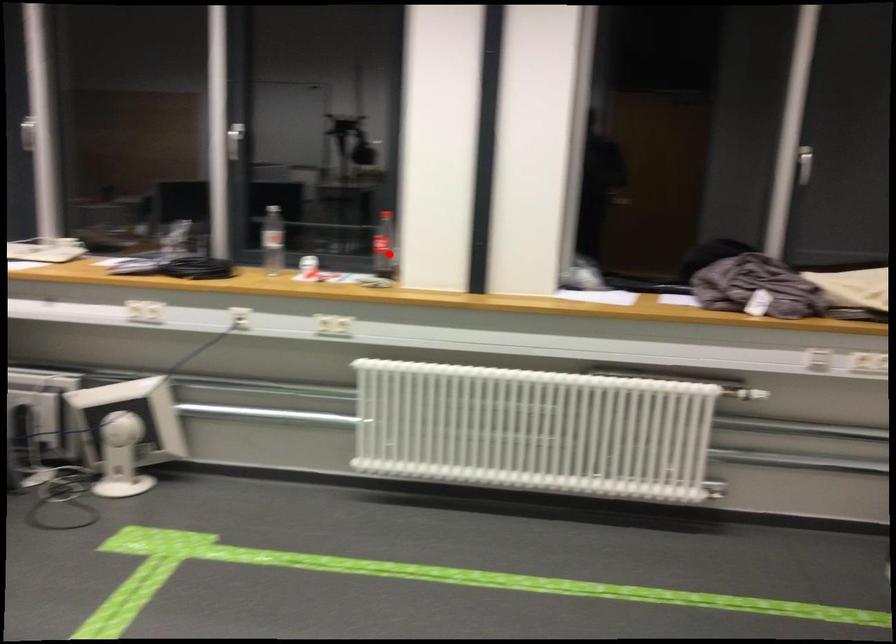
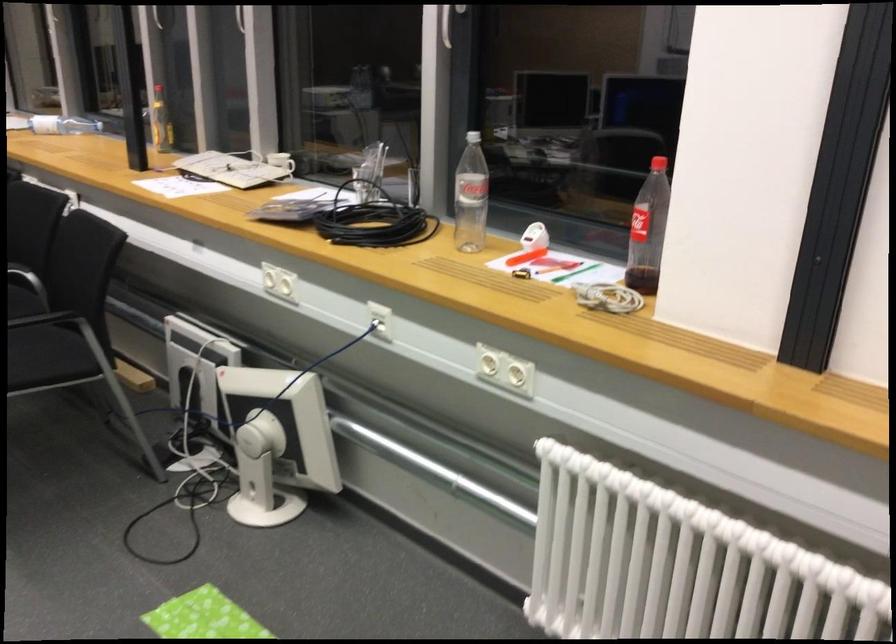
Question: I am providing you with two images of the same scene from different viewpoints. A red point is shown in image1. For the corresponding object point in image2, is it positioned nearer or farther from the camera?

Choices:
 (A) Nearer
 (B) Farther

Answer: (A)